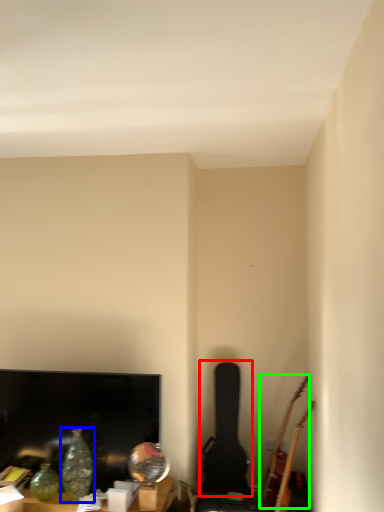
Question: Which is nearer to the guitar (highlighted by a red box)? glass vase (highlighted by a blue box) or guitar (highlighted by a green box).

Choices:
 (A) glass vase
 (B) guitar

Answer: (B)